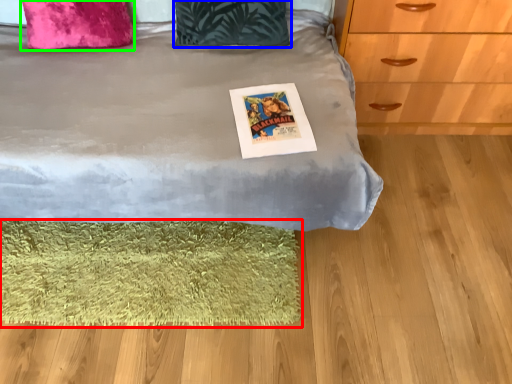
Question: Considering the real-world distances, which object is closest to mat (highlighted by a red box)? pillow (highlighted by a blue box) or pillow (highlighted by a green box).

Choices:
 (A) pillow
 (B) pillow

Answer: (A)